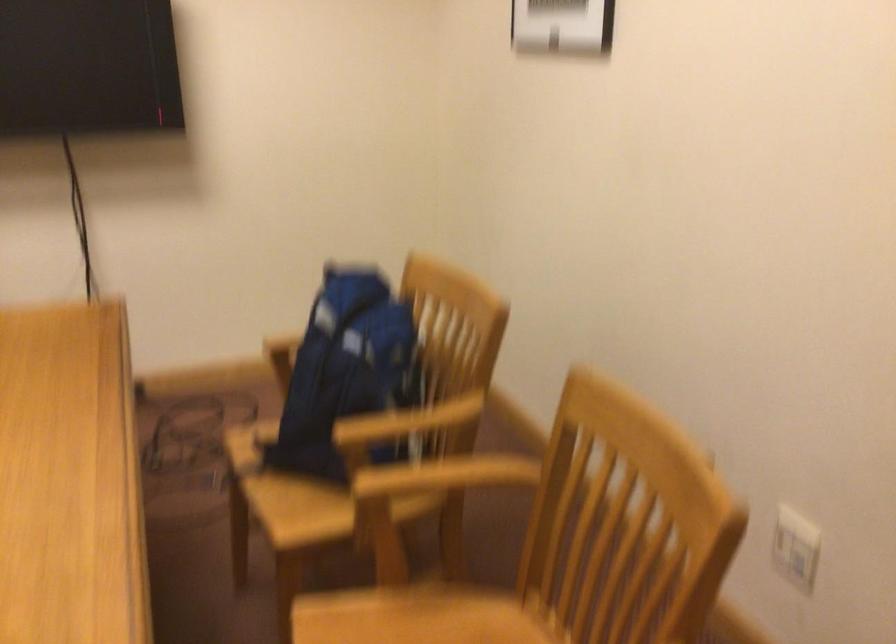
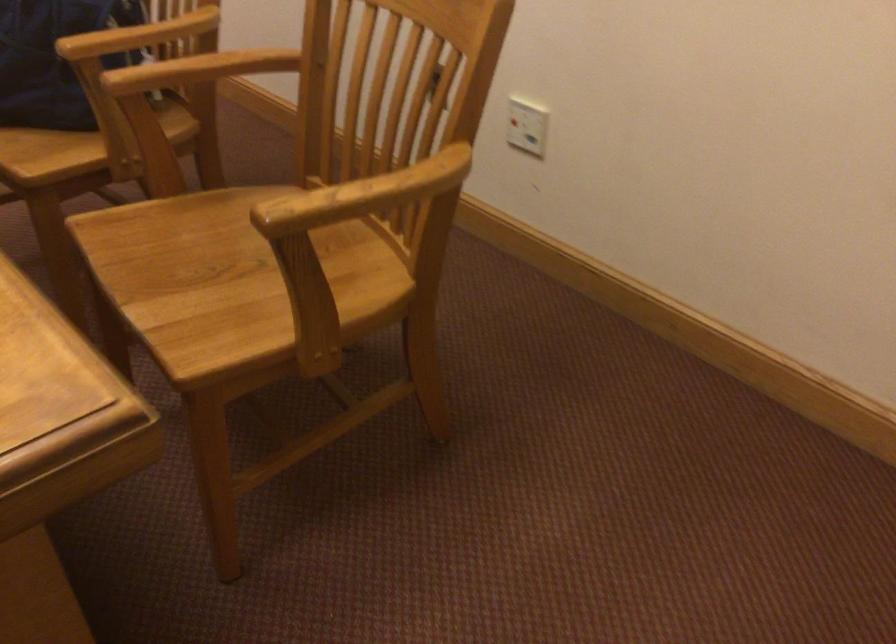
From the picture: The first image is from the beginning of the video and the second image is from the end. How did the camera likely rotate when shooting the video?

The rotation direction of the camera is right-down.